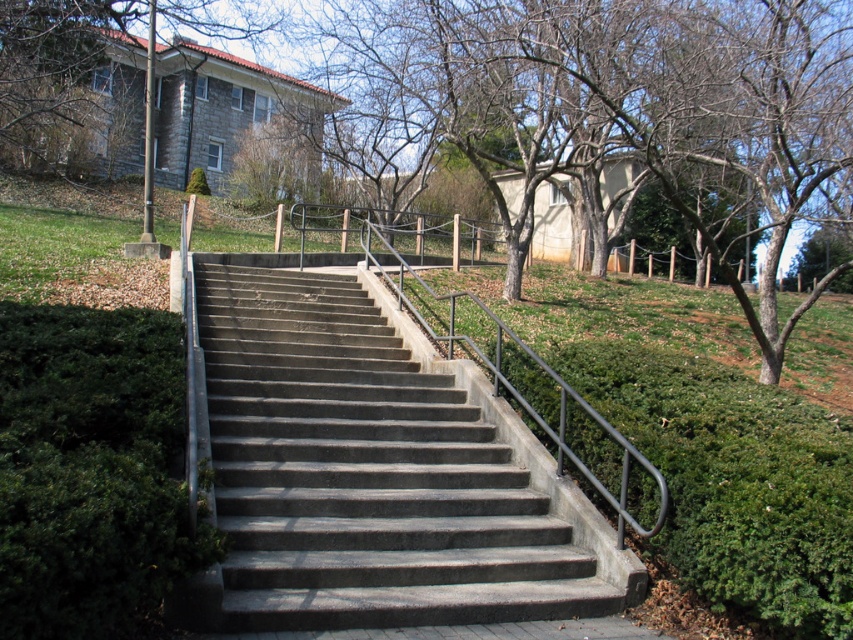
Consider the image. You are standing on the stairs and want to reach a point closer to you. Which point should you go to, point (643, 145) or point (82, 388)?

Point (643, 145) is further to the viewer than point (82, 388), so you should go to point (82, 388) since it is closer to you.